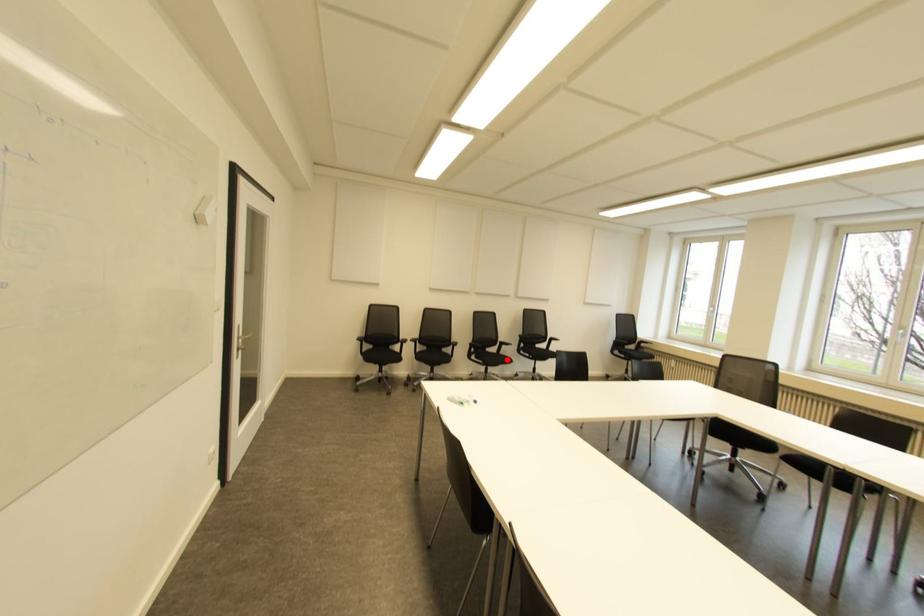
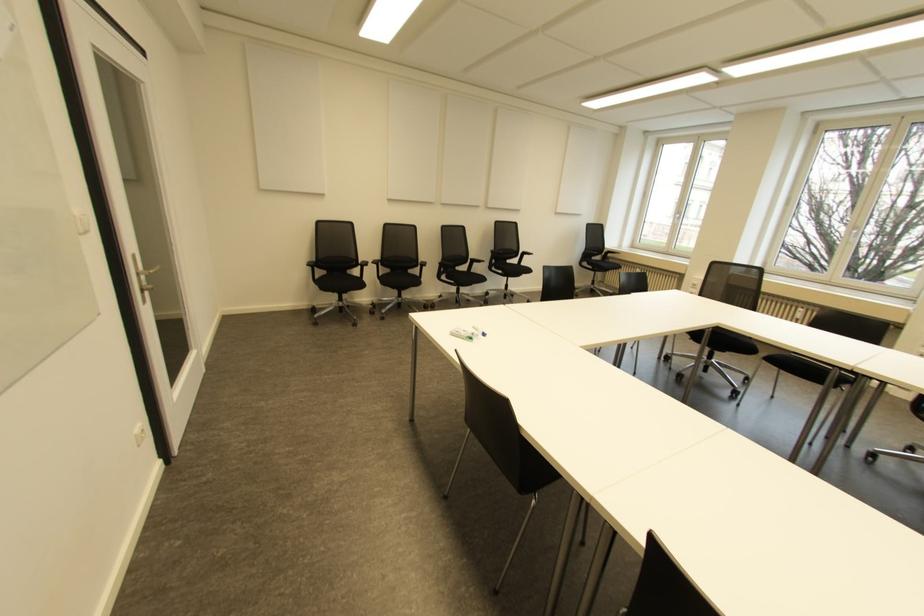
Where in the second image is the point corresponding to the highlighted location from the first image?

(480, 278)